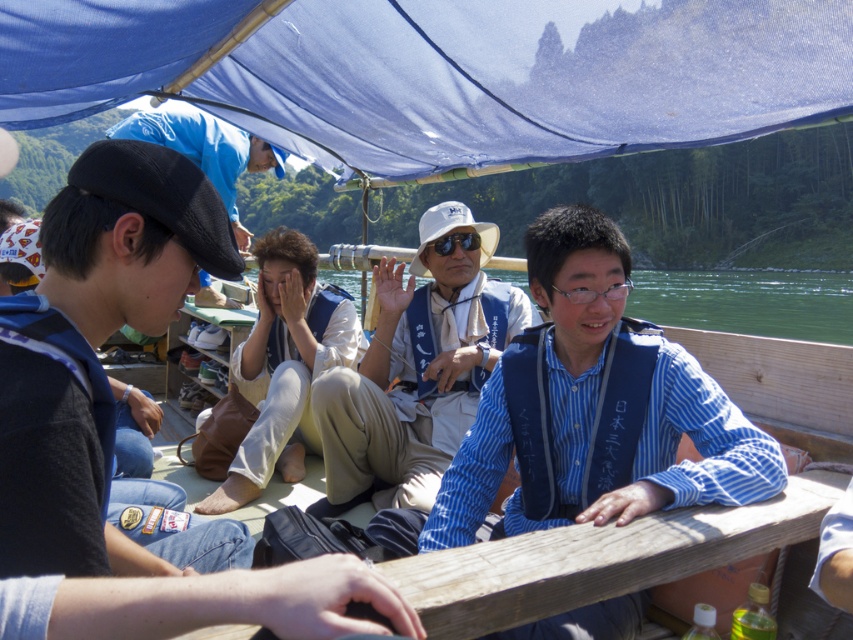
Does dark blue denim jeans at left come behind green water at center?

No, dark blue denim jeans at left is closer to the viewer.

Can you confirm if dark blue denim jeans at left is shorter than green water at center?

Yes.

Is point (15, 360) farther from viewer compared to point (811, 280)?

No, (15, 360) is closer to viewer.

Identify the location of dark blue denim jeans at left. The width and height of the screenshot is (853, 640). (112, 416).

Is point (283, 280) closer to viewer compared to point (722, 275)?

That is True.

Does white cotton shirt at center come behind green water at center?

Yes, it is behind green water at center.

Find the location of a particular element. Image resolution: width=853 pixels, height=640 pixels. white cotton shirt at center is located at coordinates click(x=285, y=364).

Who is higher up, dark blue denim jeans at left or white fabric hat at center?

white fabric hat at center

Is dark blue denim jeans at left smaller than white fabric hat at center?

Correct, dark blue denim jeans at left occupies less space than white fabric hat at center.

The width and height of the screenshot is (853, 640). I want to click on dark blue denim jeans at left, so click(112, 416).